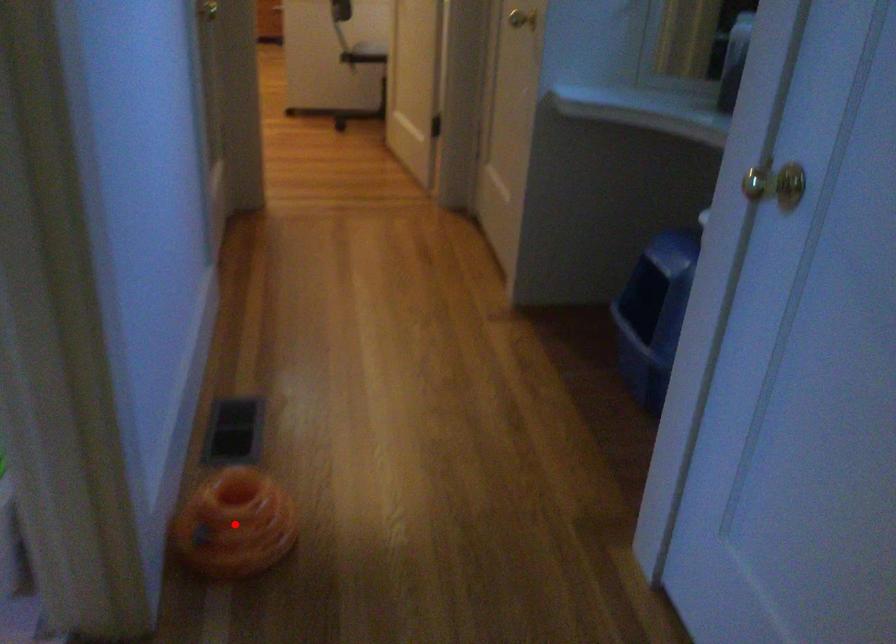
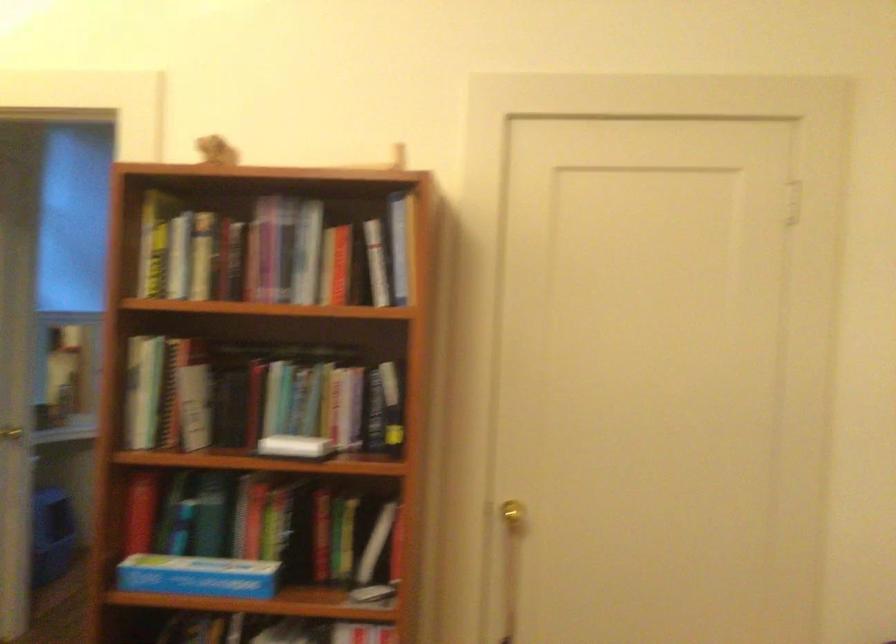
Question: I am providing you with two images of the same scene from different viewpoints. A red point is marked on the first image. At the location where the point appears in image 1, is it still visible in image 2?

Choices:
 (A) Yes
 (B) No

Answer: (B)